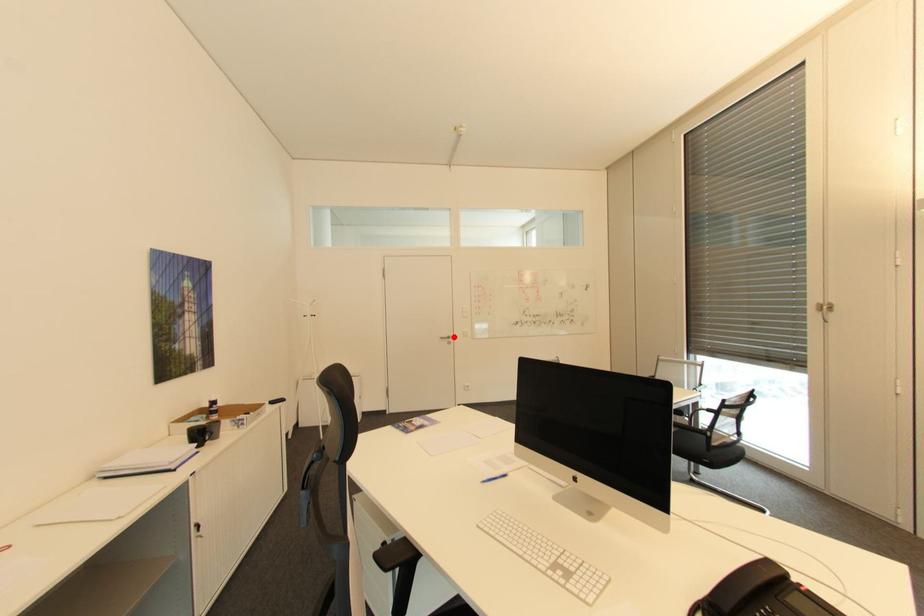
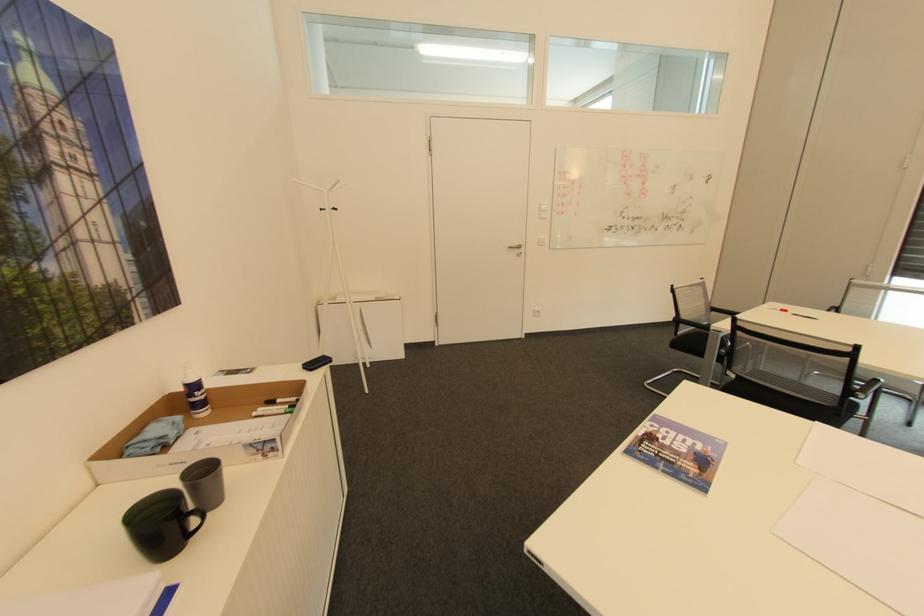
Question: I am providing you with two images of the same scene from different viewpoints. A red point is shown in image1. For the corresponding object point in image2, is it positioned nearer or farther from the camera?

Choices:
 (A) Nearer
 (B) Farther

Answer: (A)